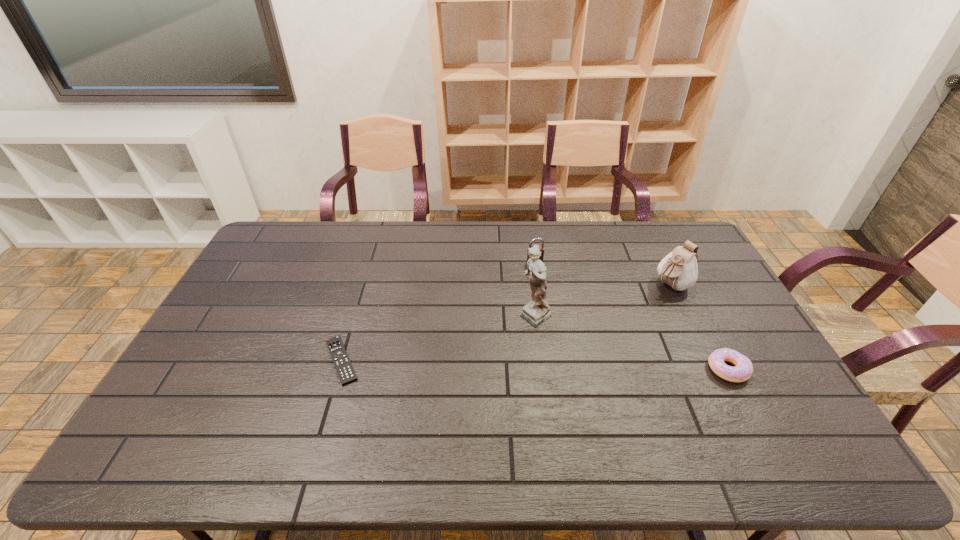
I want to click on free space between the padlock and the second shortest object, so click(x=632, y=316).

Where is `free point between the second shortest object and the second tallest object`? This screenshot has height=540, width=960. free point between the second shortest object and the second tallest object is located at coordinates (699, 327).

Identify the location of empty space that is in between the doughnut and the shortest object. This screenshot has height=540, width=960. (535, 364).

Identify the location of free space between the fourth tallest object and the third tallest object. (632, 316).

Where is `free space between the remote control and the fourth nearest object`? The image size is (960, 540). free space between the remote control and the fourth nearest object is located at coordinates (506, 322).

Locate an element on the screen. The height and width of the screenshot is (540, 960). object that is the second closest to the fourth tallest object is located at coordinates (537, 311).

Locate an element on the screen. Image resolution: width=960 pixels, height=540 pixels. object that can be found as the fourth closest to the fourth nearest object is located at coordinates (346, 373).

I want to click on vacant space that satisfies the following two spatial constraints: 1. on the back side of the shortest object; 2. on the right side of the fourth nearest object, so pyautogui.click(x=364, y=285).

Find the location of a particular element. Image resolution: width=960 pixels, height=540 pixels. free location that satisfies the following two spatial constraints: 1. on the back side of the tallest object; 2. on the left side of the padlock is located at coordinates (529, 263).